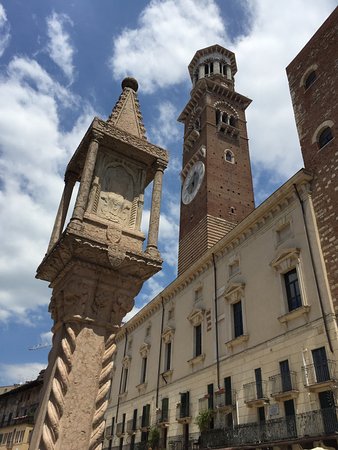
The height and width of the screenshot is (450, 338). Identify the location of clock. (194, 182).